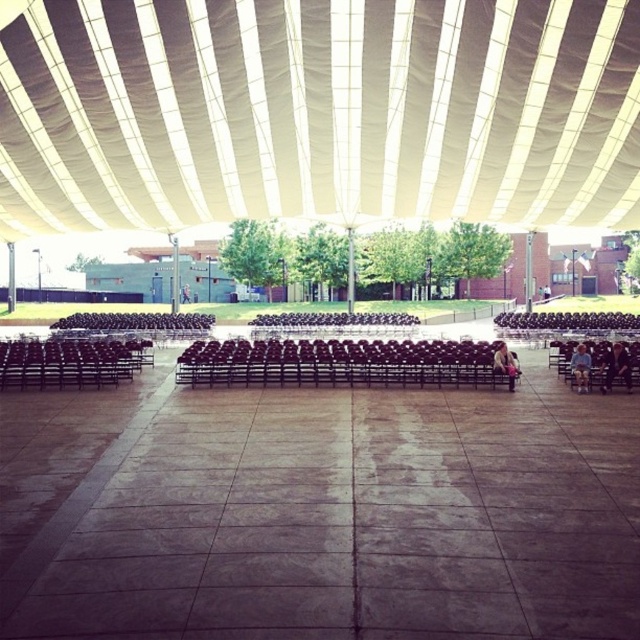
Question: Is dark brown leather jacket at lower right thinner than white fabric person at center?

Choices:
 (A) yes
 (B) no

Answer: (B)

Question: Is dark brown leather jacket at lower right to the right of blue denim jeans at lower right from the viewer's perspective?

Choices:
 (A) yes
 (B) no

Answer: (A)

Question: Can you confirm if blue denim jeans at lower right is smaller than white fabric person at center?

Choices:
 (A) yes
 (B) no

Answer: (B)

Question: Which point is closer to the camera?

Choices:
 (A) denim jacket at lower right
 (B) white fabric person at center

Answer: (A)

Question: Among these objects, which one is farthest from the camera?

Choices:
 (A) white fabric person at center
 (B) white fabric canopy at upper center
 (C) denim jacket at lower right

Answer: (A)

Question: Which of the following is the closest to the observer?

Choices:
 (A) dark brown leather jacket at lower right
 (B) denim jacket at lower right

Answer: (A)